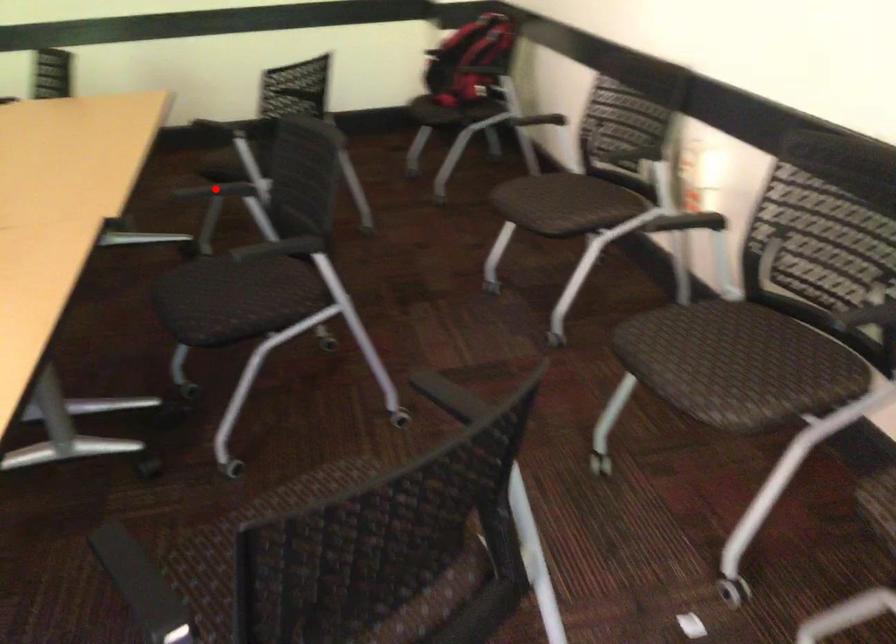
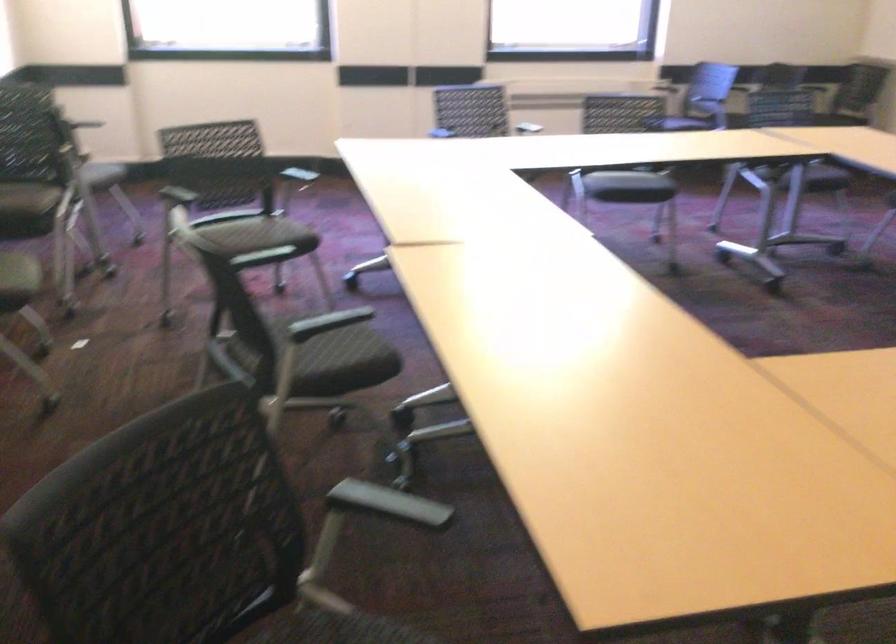
Question: I am providing you with two images of the same scene from different viewpoints. A red point is marked on the first image. At the location where the point appears in image 1, is it still visible in image 2?

Choices:
 (A) Yes
 (B) No

Answer: (B)